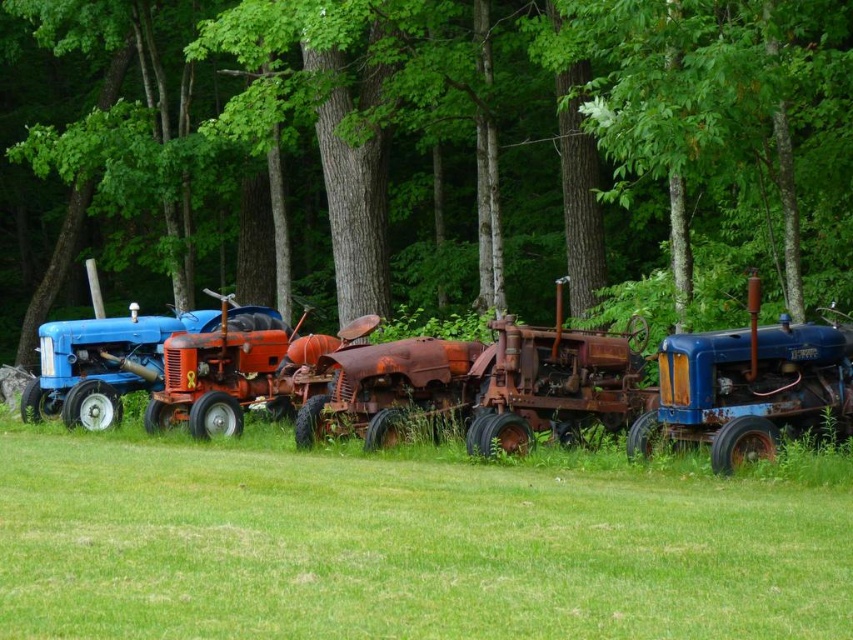
Can you confirm if green grass at center is taller than blue matte tractor at right?

In fact, green grass at center may be shorter than blue matte tractor at right.

Identify the location of green grass at center. The width and height of the screenshot is (853, 640). (403, 545).

Is green grass at center above rusty metal tractor at center?

No.

Image resolution: width=853 pixels, height=640 pixels. Find the location of `green grass at center`. green grass at center is located at coordinates (403, 545).

Who is more forward, (x=830, y=144) or (x=763, y=360)?

Point (x=763, y=360) is in front.

Between green leafy tree at center and blue matte tractor at right, which one has less height?

blue matte tractor at right is shorter.

Is point (844, 173) positioned after point (699, 332)?

Yes, point (844, 173) is farther from viewer.

Find the location of a particular element. The height and width of the screenshot is (640, 853). green leafy tree at center is located at coordinates (488, 147).